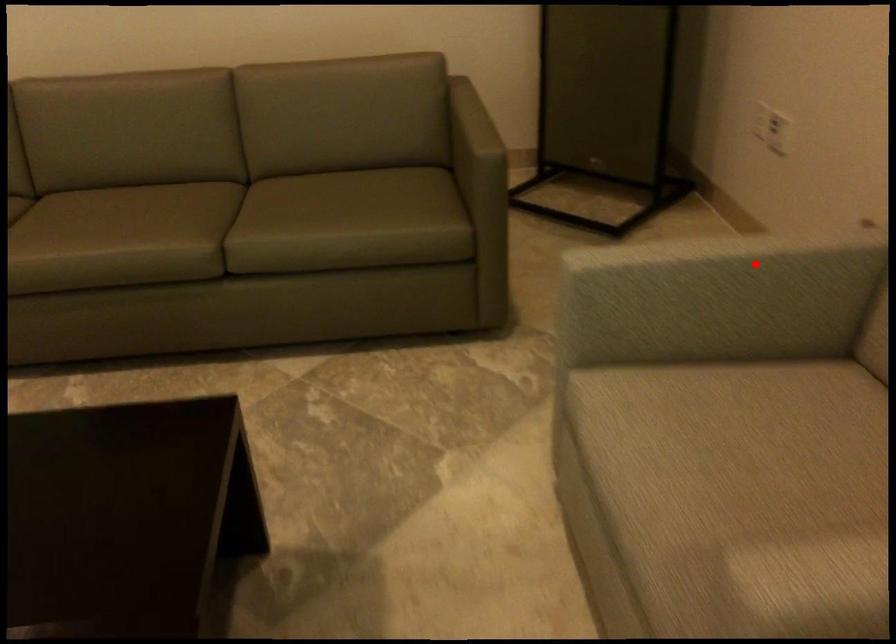
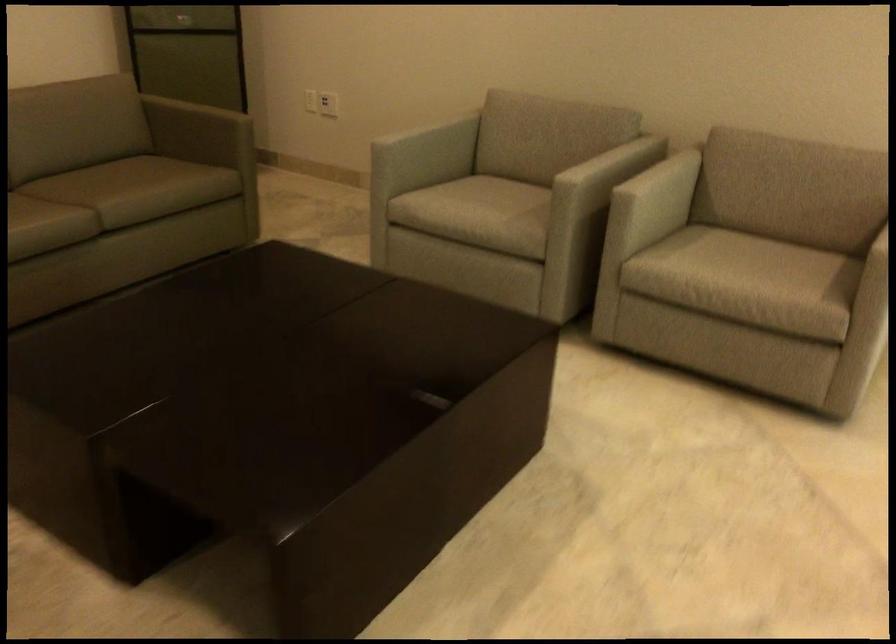
Question: I am providing you with two images of the same scene from different viewpoints. Image1 has a red point marked. In image2, the corresponding 3D location appears at what relative position? Reply with the corresponding letter.

Choices:
 (A) Closer
 (B) Farther

Answer: (B)